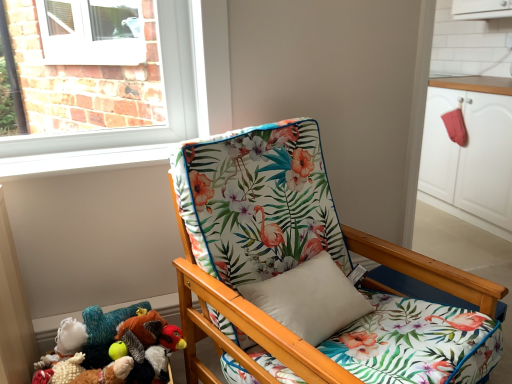
Question: Can you confirm if white matte cabinet at right is shorter than fluffy white stuffed animal at lower left, marked as the first toy in a left-to-right arrangement?

Choices:
 (A) no
 (B) yes

Answer: (A)

Question: Is white matte cabinet at right beside fluffy white stuffed animal at lower left, placed as the second toy when sorted from right to left?

Choices:
 (A) yes
 (B) no

Answer: (B)

Question: Is white matte cabinet at right taller than fluffy white stuffed animal at lower left, marked as the first toy in a left-to-right arrangement?

Choices:
 (A) yes
 (B) no

Answer: (A)

Question: Is the depth of white matte cabinet at right less than that of fluffy white stuffed animal at lower left, placed as the second toy when sorted from right to left?

Choices:
 (A) no
 (B) yes

Answer: (A)

Question: From the image's perspective, is white matte cabinet at right located beneath fluffy white stuffed animal at lower left, placed as the second toy when sorted from right to left?

Choices:
 (A) yes
 (B) no

Answer: (B)

Question: Is white matte cabinet at right wider or thinner than fluffy plush toy at lower left, the 2th toy from the left?

Choices:
 (A) wide
 (B) thin

Answer: (A)

Question: Based on their positions, is white matte cabinet at right located to the left or right of fluffy plush toy at lower left, marked as the 1th toy in a right-to-left arrangement?

Choices:
 (A) right
 (B) left

Answer: (A)

Question: From the image's perspective, is white matte cabinet at right above or below fluffy plush toy at lower left, marked as the 1th toy in a right-to-left arrangement?

Choices:
 (A) above
 (B) below

Answer: (A)

Question: Considering their positions, is white matte cabinet at right located in front of or behind fluffy plush toy at lower left, marked as the 1th toy in a right-to-left arrangement?

Choices:
 (A) front
 (B) behind

Answer: (B)

Question: Considering the positions of point (326, 352) and point (125, 359), is point (326, 352) closer or farther from the camera than point (125, 359)?

Choices:
 (A) closer
 (B) farther

Answer: (A)

Question: Choose the correct answer: Is floral fabric chair at center inside fluffy plush toy at lower left, marked as the 1th toy in a right-to-left arrangement, or outside it?

Choices:
 (A) inside
 (B) outside

Answer: (B)

Question: Is floral fabric chair at center wider or thinner than fluffy plush toy at lower left, marked as the 1th toy in a right-to-left arrangement?

Choices:
 (A) wide
 (B) thin

Answer: (A)

Question: Would you say floral fabric chair at center is to the left or to the right of fluffy plush toy at lower left, marked as the 1th toy in a right-to-left arrangement, in the picture?

Choices:
 (A) left
 (B) right

Answer: (B)

Question: Based on their positions, is white matte cabinet at right located to the left or right of floral fabric chair at center?

Choices:
 (A) right
 (B) left

Answer: (A)

Question: Is white matte cabinet at right spatially inside floral fabric chair at center, or outside of it?

Choices:
 (A) outside
 (B) inside

Answer: (A)